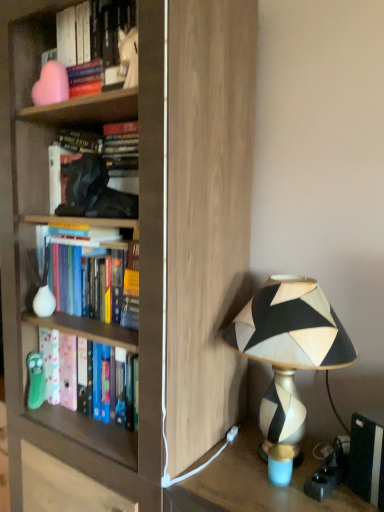
Question: Should I look upward or downward to see black matte book at lower right?

Choices:
 (A) up
 (B) down

Answer: (B)

Question: Is geometric-patterned lampshade at right at the right side of hardcover books at center left, which is the second book from bottom to top?

Choices:
 (A) yes
 (B) no

Answer: (A)

Question: From a real-world perspective, is geometric-patterned lampshade at right physically below hardcover books at center left, which is the 3th book in top-to-bottom order?

Choices:
 (A) no
 (B) yes

Answer: (B)

Question: Can you confirm if geometric-patterned lampshade at right is bigger than hardcover books at center left, which is the 3th book in top-to-bottom order?

Choices:
 (A) no
 (B) yes

Answer: (B)

Question: Is geometric-patterned lampshade at right to the left of hardcover books at center left, which is the second book from bottom to top, from the viewer's perspective?

Choices:
 (A) yes
 (B) no

Answer: (B)

Question: Is geometric-patterned lampshade at right beside hardcover books at center left, which is the 3th book in top-to-bottom order?

Choices:
 (A) no
 (B) yes

Answer: (A)

Question: Is geometric-patterned lampshade at right facing towards hardcover books at center left, which is the second book from bottom to top?

Choices:
 (A) yes
 (B) no

Answer: (B)

Question: Would you say hardcover book at center, the 2th book from the top, is a long distance from matte wood bookcase at center?

Choices:
 (A) no
 (B) yes

Answer: (A)

Question: From a real-world perspective, is hardcover book at center, the 3th book in the bottom-to-top sequence, beneath matte wood bookcase at center?

Choices:
 (A) yes
 (B) no

Answer: (B)

Question: From a real-world perspective, is hardcover book at center, the 3th book in the bottom-to-top sequence, located higher than matte wood bookcase at center?

Choices:
 (A) yes
 (B) no

Answer: (A)

Question: Is hardcover book at center, the 3th book in the bottom-to-top sequence, smaller than matte wood bookcase at center?

Choices:
 (A) no
 (B) yes

Answer: (B)

Question: Does hardcover book at center, the 3th book in the bottom-to-top sequence, have a greater height compared to matte wood bookcase at center?

Choices:
 (A) yes
 (B) no

Answer: (B)

Question: Is hardcover book at center, the 3th book in the bottom-to-top sequence, positioned with its back to matte wood bookcase at center?

Choices:
 (A) yes
 (B) no

Answer: (A)

Question: Does matte wood bookcase at center have a greater height compared to geometric-patterned lampshade at right?

Choices:
 (A) no
 (B) yes

Answer: (B)